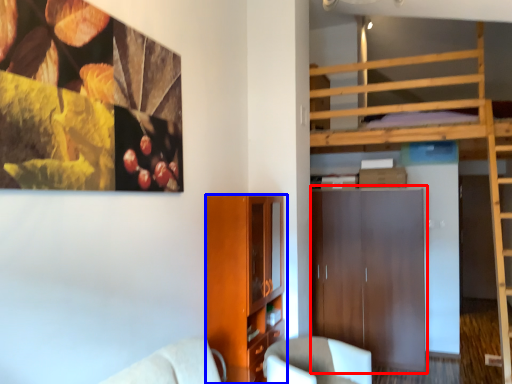
Question: Which object is closer to the camera taking this photo, dresser (highlighted by a red box) or cabinetry (highlighted by a blue box)?

Choices:
 (A) dresser
 (B) cabinetry

Answer: (B)